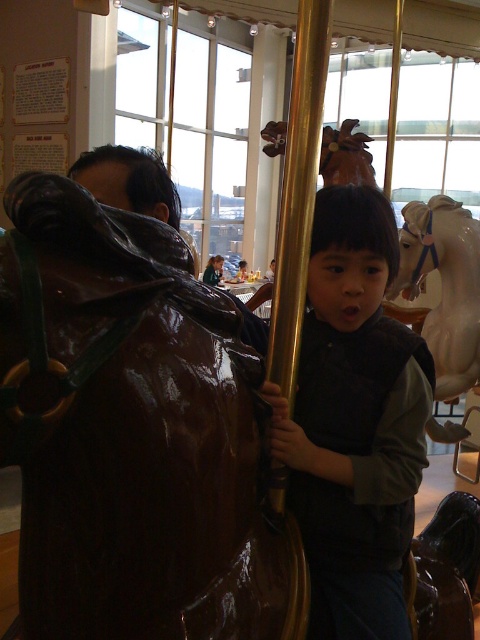
You are a parent trying to decide whether to let your child sit on the glossy brown horse at left or the matte black vest at center. Which object is wider?

The glossy brown horse at left is wider than the matte black vest at center.

You are at an amusement park and want to choose a carousel horse that is smaller in size. Which horse should you pick between the glossy brown horse at left and the white glossy horse at center?

The glossy brown horse at left has a smaller size compared to the white glossy horse at center, so you should pick the glossy brown horse at left.

You are a parent trying to take a photo of your child on the carousel. You want to ensure both the glossy brown horse at left and the matte black vest at center are clearly visible in the frame. Given their heights, which object should you focus on first to ensure proper focus?

The glossy brown horse at left is shorter than the matte black vest at center. To ensure both are in focus, you should focus on the matte black vest at center first since it is taller and likely closer to the background, allowing the shorter horse to be within the depth of field.